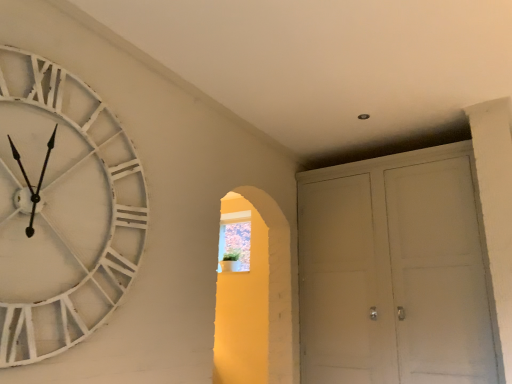
This screenshot has width=512, height=384. What do you see at coordinates (62, 210) in the screenshot? I see `white distressed wood clock at left` at bounding box center [62, 210].

The width and height of the screenshot is (512, 384). Identify the location of white matte cabinet at right. (393, 272).

Does translucent glass window at center turn towards white distressed wood clock at left?

Yes, translucent glass window at center faces towards white distressed wood clock at left.

Is translucent glass window at center inside the boundaries of white distressed wood clock at left, or outside?

translucent glass window at center is not inside white distressed wood clock at left, it's outside.

Between translucent glass window at center and white distressed wood clock at left, which one has larger size?

Bigger between the two is white distressed wood clock at left.

Between translucent glass window at center and white distressed wood clock at left, which one has smaller width?

white distressed wood clock at left.

From a real-world perspective, is white distressed wood clock at left above or below white matte cabinet at right?

white distressed wood clock at left is situated higher than white matte cabinet at right in the real world.

Considering the relative sizes of white distressed wood clock at left and white matte cabinet at right in the image provided, is white distressed wood clock at left shorter than white matte cabinet at right?

Correct, white distressed wood clock at left is not as tall as white matte cabinet at right.

Looking at this image, is the position of white distressed wood clock at left more distant than that of white matte cabinet at right?

No, it is in front of white matte cabinet at right.

From the picture: From a real-world perspective, who is located higher, white matte cabinet at right or translucent glass window at center?

From a 3D spatial view, translucent glass window at center is above.

Which is in front, point (331, 294) or point (227, 238)?

Point (331, 294)

Is white matte cabinet at right positioned with its back to translucent glass window at center?

white matte cabinet at right is not turned away from translucent glass window at center.

Considering the relative positions of white matte cabinet at right and translucent glass window at center in the image provided, is white matte cabinet at right to the right of translucent glass window at center from the viewer's perspective?

Correct, you'll find white matte cabinet at right to the right of translucent glass window at center.

Where is `door lying on the right of translucent glass window at center`? This screenshot has width=512, height=384. door lying on the right of translucent glass window at center is located at coordinates (393, 272).

In the scene shown: Is translucent glass window at center shorter than white matte cabinet at right?

Indeed, translucent glass window at center has a lesser height compared to white matte cabinet at right.

Considering the relative sizes of translucent glass window at center and white matte cabinet at right in the image provided, is translucent glass window at center smaller than white matte cabinet at right?

Indeed, translucent glass window at center has a smaller size compared to white matte cabinet at right.

Consider the image. Would you say white matte cabinet at right is part of translucent glass window at center's contents?

No.

Which point is more forward, (466,277) or (27,339)?

Point (27,339)

How much distance is there between white matte cabinet at right and white distressed wood clock at left?

The distance of white matte cabinet at right from white distressed wood clock at left is 2.03 meters.

From a real-world perspective, is white matte cabinet at right above or below white distressed wood clock at left?

Clearly, from a real-world perspective, white matte cabinet at right is below white distressed wood clock at left.

Considering the relative positions of white distressed wood clock at left and translucent glass window at center in the image provided, is white distressed wood clock at left to the left or to the right of translucent glass window at center?

white distressed wood clock at left is positioned on translucent glass window at center's left side.

Is white distressed wood clock at left bigger or smaller than translucent glass window at center?

Considering their sizes, white distressed wood clock at left takes up more space than translucent glass window at center.

Considering the relative sizes of white distressed wood clock at left and translucent glass window at center in the image provided, is white distressed wood clock at left thinner than translucent glass window at center?

Correct, the width of white distressed wood clock at left is less than that of translucent glass window at center.

Can you tell me how much white distressed wood clock at left and translucent glass window at center differ in facing direction?

white distressed wood clock at left and translucent glass window at center are facing 88.4 degrees away from each other.

Find the location of a particular element. This screenshot has height=384, width=512. wall clock located in front of the translucent glass window at center is located at coordinates (62, 210).

The width and height of the screenshot is (512, 384). In order to click on door behind the white distressed wood clock at left in this screenshot , I will do `click(393, 272)`.

From the image, which object appears to be farther from white matte cabinet at right, translucent glass window at center or white distressed wood clock at left?

white distressed wood clock at left is further to white matte cabinet at right.

Based on the photo, based on their spatial positions, is white matte cabinet at right or translucent glass window at center further from white distressed wood clock at left?

translucent glass window at center lies further to white distressed wood clock at left than the other object.

From the image, which object appears to be farther from white matte cabinet at right, white distressed wood clock at left or translucent glass window at center?

white distressed wood clock at left is further to white matte cabinet at right.

Looking at this image, when comparing their distances from white distressed wood clock at left, does translucent glass window at center or white matte cabinet at right seem closer?

white matte cabinet at right is positioned closer to the anchor white distressed wood clock at left.

Estimate the real-world distances between objects in this image. Which object is further from translucent glass window at center, white distressed wood clock at left or white matte cabinet at right?

white distressed wood clock at left is positioned further to the anchor translucent glass window at center.

Looking at the image, which one is located closer to translucent glass window at center, white matte cabinet at right or white distressed wood clock at left?

white matte cabinet at right lies closer to translucent glass window at center than the other object.

You are a GUI agent. You are given a task and a screenshot of the screen. Output one action in this format:
    pyautogui.click(x=<x>, y=<y>)
    Task: Click on the door located between white distressed wood clock at left and translucent glass window at center in the depth direction
    
    Given the screenshot: What is the action you would take?
    pyautogui.click(x=393, y=272)